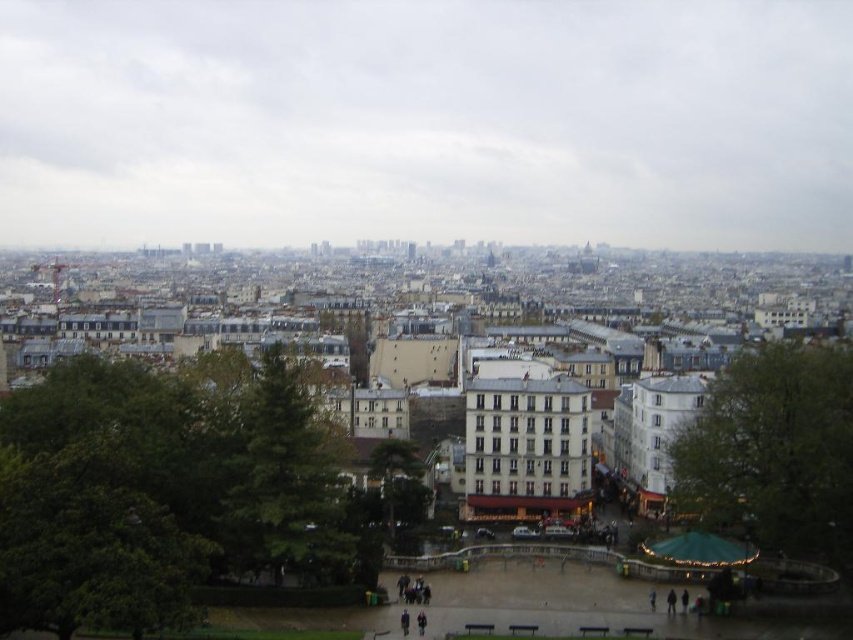
Which is below, green textured tree at center-left or green textured tree at center?

Positioned lower is green textured tree at center.

Does point (320, 538) lie behind point (378, 465)?

No, (320, 538) is closer to viewer.

Between point (254, 560) and point (422, 470), which one is positioned in front?

Point (254, 560) is more forward.

The width and height of the screenshot is (853, 640). I want to click on green textured tree at center-left, so click(283, 481).

Does white cloudy sky at upper center lie behind green textured tree at center?

Yes, white cloudy sky at upper center is behind green textured tree at center.

Does point (329, 3) come farther from viewer compared to point (416, 470)?

Yes.

The height and width of the screenshot is (640, 853). I want to click on white cloudy sky at upper center, so click(x=426, y=122).

Where is `white cloudy sky at upper center`? The width and height of the screenshot is (853, 640). white cloudy sky at upper center is located at coordinates (426, 122).

Is green leafy tree at center thinner than dark clothing at center?

Incorrect, green leafy tree at center's width is not less than dark clothing at center's.

Identify the location of green leafy tree at center. (775, 451).

Find the location of `green leafy tree at center`. green leafy tree at center is located at coordinates (775, 451).